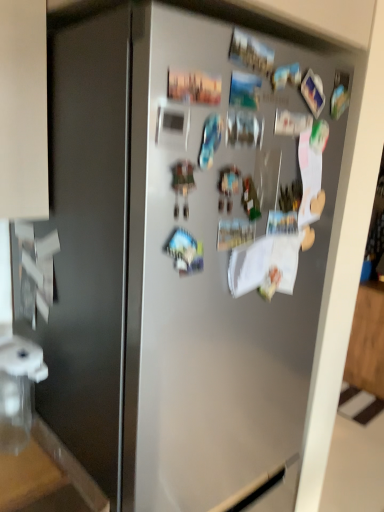
Question: From a real-world perspective, relative to wooden countertop at lower left, is clear plastic water filter at lower left vertically above or below?

Choices:
 (A) below
 (B) above

Answer: (B)

Question: Is clear plastic water filter at lower left in front of or behind wooden countertop at lower left in the image?

Choices:
 (A) front
 (B) behind

Answer: (B)

Question: Looking at the image, does clear plastic water filter at lower left seem bigger or smaller compared to wooden countertop at lower left?

Choices:
 (A) big
 (B) small

Answer: (A)

Question: Do you think wooden countertop at lower left is within clear plastic water filter at lower left, or outside of it?

Choices:
 (A) outside
 (B) inside

Answer: (A)

Question: In the image, is wooden countertop at lower left on the left side or the right side of clear plastic water filter at lower left?

Choices:
 (A) left
 (B) right

Answer: (A)

Question: Considering the positions of wooden countertop at lower left and clear plastic water filter at lower left in the image, is wooden countertop at lower left bigger or smaller than clear plastic water filter at lower left?

Choices:
 (A) big
 (B) small

Answer: (B)

Question: From a real-world perspective, relative to clear plastic water filter at lower left, is wooden countertop at lower left vertically above or below?

Choices:
 (A) above
 (B) below

Answer: (B)